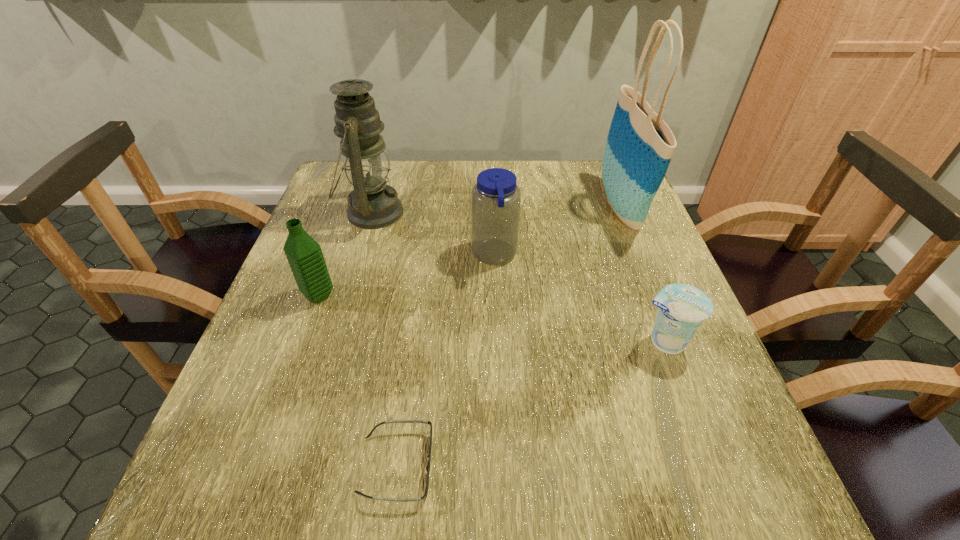
Locate an element on the screen. object positioned at the near edge is located at coordinates (393, 421).

This screenshot has width=960, height=540. Find the location of `oil lamp at the left edge`. oil lamp at the left edge is located at coordinates (372, 204).

Locate an element on the screen. water bottle at the left edge is located at coordinates (304, 255).

The height and width of the screenshot is (540, 960). In order to click on tote bag present at the right edge in this screenshot , I will do `click(639, 147)`.

Where is `yogurt that is at the right edge`? The image size is (960, 540). yogurt that is at the right edge is located at coordinates (682, 308).

Where is `object present at the far left corner`? The width and height of the screenshot is (960, 540). object present at the far left corner is located at coordinates (x=372, y=204).

Where is `object that is at the far right corner`? The width and height of the screenshot is (960, 540). object that is at the far right corner is located at coordinates (639, 147).

Locate an element on the screen. Image resolution: width=960 pixels, height=540 pixels. blank space at the far edge is located at coordinates (406, 181).

Find the location of a particular element. vacant space at the left edge is located at coordinates (274, 427).

Find the location of a particular element. The image size is (960, 540). vacant space at the right edge of the desktop is located at coordinates (650, 245).